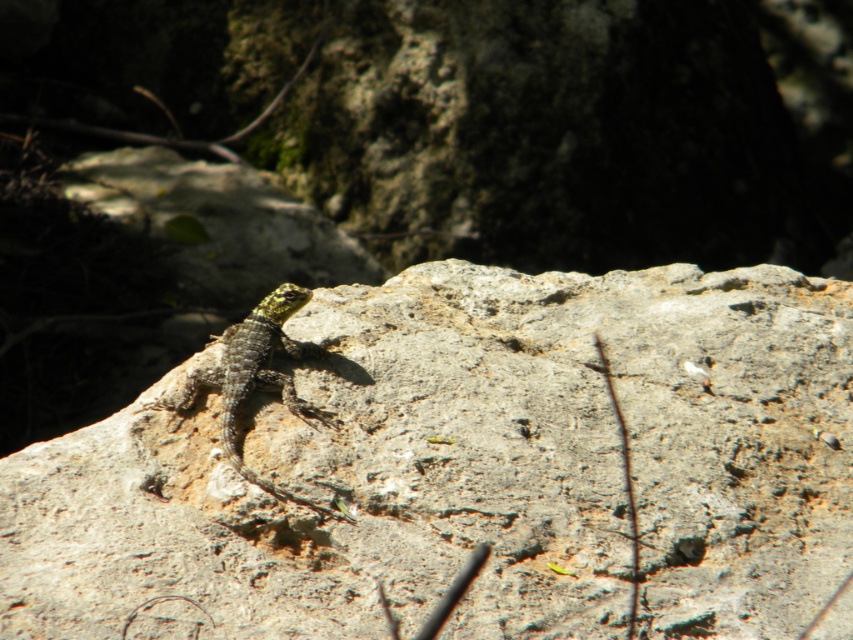
Does gray rough rock at center have a lesser height compared to green scaly lizard at center?

In fact, gray rough rock at center may be taller than green scaly lizard at center.

How distant is gray rough rock at center from green scaly lizard at center?

The distance of gray rough rock at center from green scaly lizard at center is 26.16 centimeters.

Where is `gray rough rock at center`? The image size is (853, 640). gray rough rock at center is located at coordinates (471, 468).